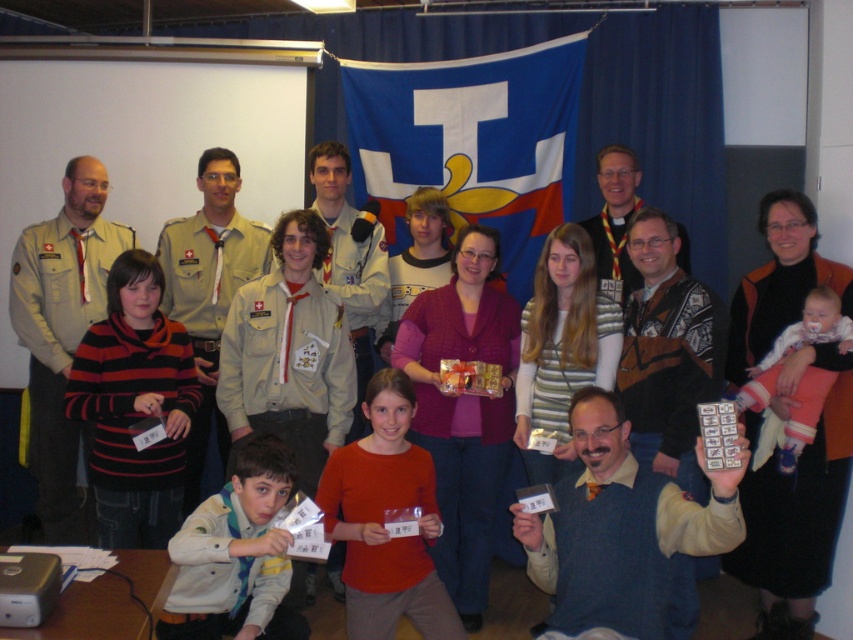
You are standing in the room and see the point marked at coordinates [61,332]. What object is located at that point?

The point at [61,332] marks the location of the matte khaki shirt at center.

You are organizing a group photo and need to ensure that the blue sweater at center and the matte black vest at center are exactly 1 meter apart. Based on the scene description, is the current spacing between them sufficient?

The distance between the blue sweater at center and the matte black vest at center is 1.02 meters, which is slightly more than 1 meter. Therefore, the spacing is sufficient for the requirement.